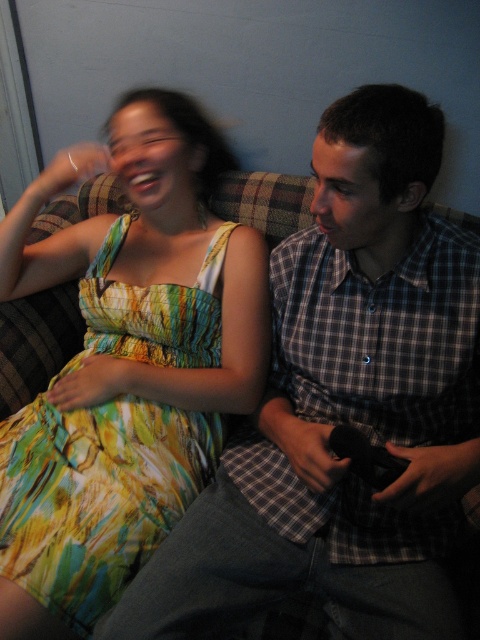
Question: Does plaid shirt at center have a greater width compared to printed fabric dress at left?

Choices:
 (A) yes
 (B) no

Answer: (A)

Question: Which point is closer to the camera?

Choices:
 (A) plaid shirt at center
 (B) printed fabric dress at left

Answer: (A)

Question: Does plaid shirt at center appear over printed fabric dress at left?

Choices:
 (A) no
 (B) yes

Answer: (B)

Question: Can you confirm if plaid shirt at center is thinner than printed fabric dress at left?

Choices:
 (A) yes
 (B) no

Answer: (B)

Question: Among these objects, which one is farthest from the camera?

Choices:
 (A) printed fabric dress at left
 (B) plaid shirt at center

Answer: (A)